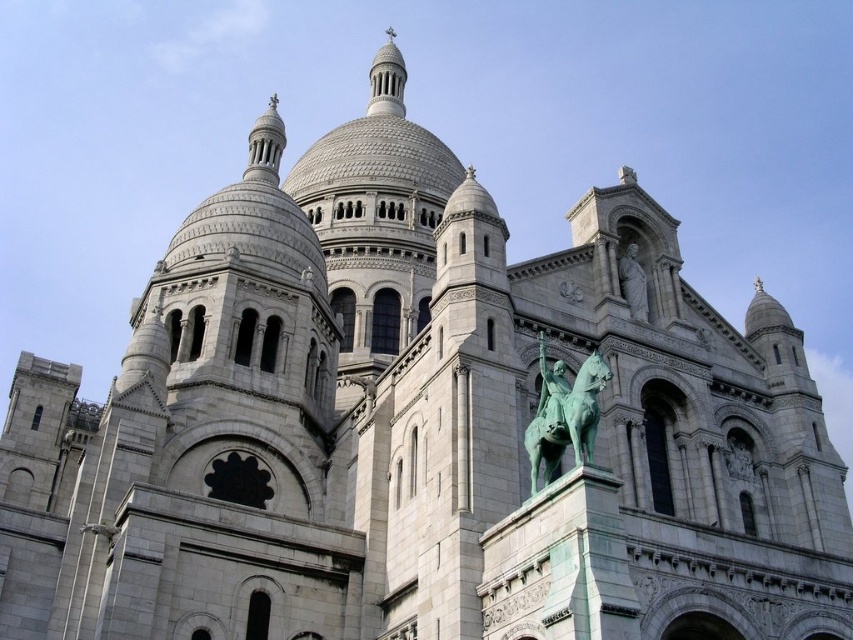
Looking at this image, you are standing in front of the Basilica of the Sacred Heart of Paris and see the green polished bronze statue at center and the green patina statue at upper right. Which statue is positioned more to the left side from your viewpoint?

The green polished bronze statue at center is positioned more to the left side from your viewpoint compared to the green patina statue at upper right.

You are an art student observing the Basilica of the Sacred Heart of Paris. You notice two statues in the scene. One is the green polished bronze statue at center and the other is the green patina statue at upper right. Which statue is wider?

The green polished bronze statue at center is wider than the green patina statue at upper right.